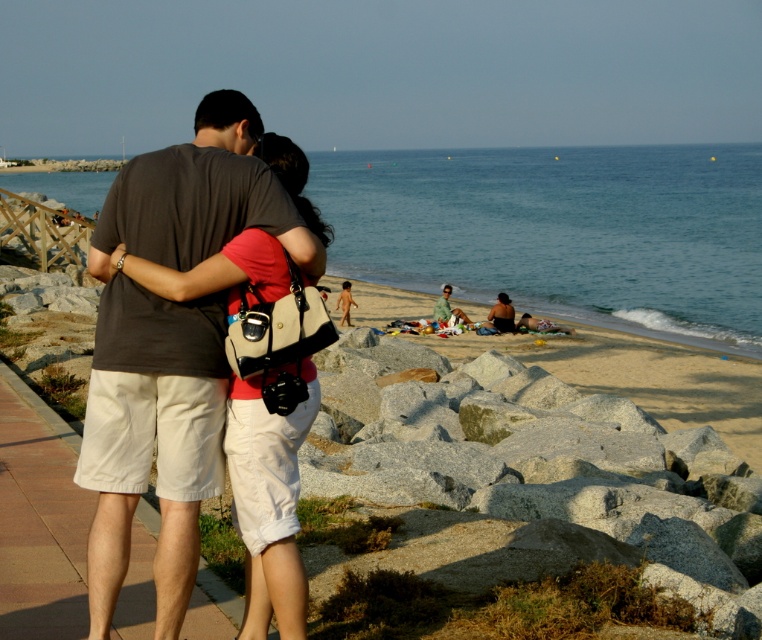
Is dark gray t-shirt at left bigger than beige fabric shirt at center?

Indeed, dark gray t-shirt at left has a larger size compared to beige fabric shirt at center.

Which is above, dark gray t-shirt at left or beige fabric shirt at center?

beige fabric shirt at center

Is point (154, 241) positioned before point (436, 310)?

That is True.

Where is `dark gray t-shirt at left`? The image size is (762, 640). dark gray t-shirt at left is located at coordinates (168, 346).

Who is positioned more to the left, blue water at center or dark gray t-shirt at left?

Positioned to the left is dark gray t-shirt at left.

Identify the location of blue water at center. This screenshot has width=762, height=640. (562, 230).

Is point (235, 177) farther from viewer compared to point (511, 310)?

That is False.

Who is more distant from viewer, (162, 531) or (498, 323)?

Positioned behind is point (498, 323).

Is point (146, 465) less distant than point (498, 305)?

Yes, point (146, 465) is closer to viewer.

The image size is (762, 640). I want to click on dark gray t-shirt at left, so click(x=168, y=346).